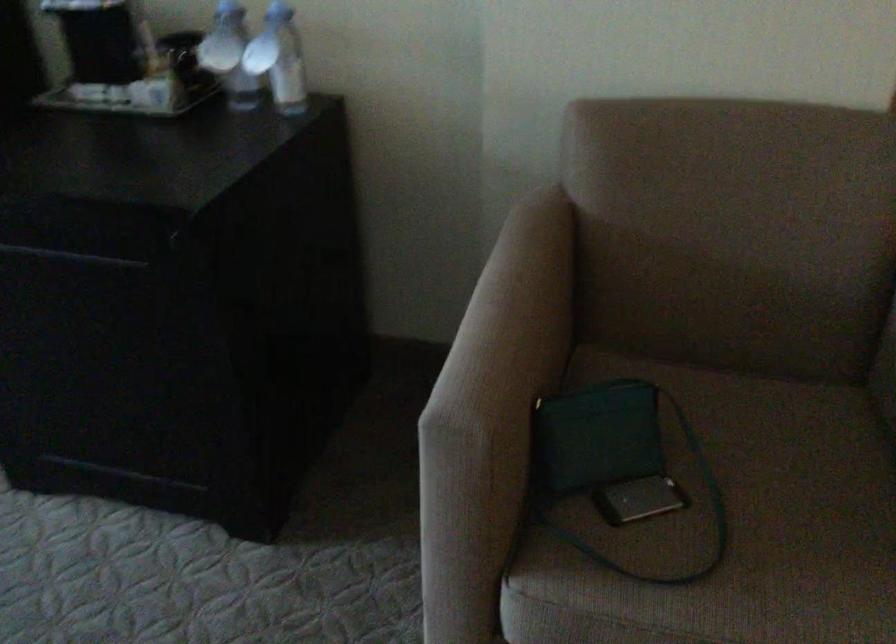
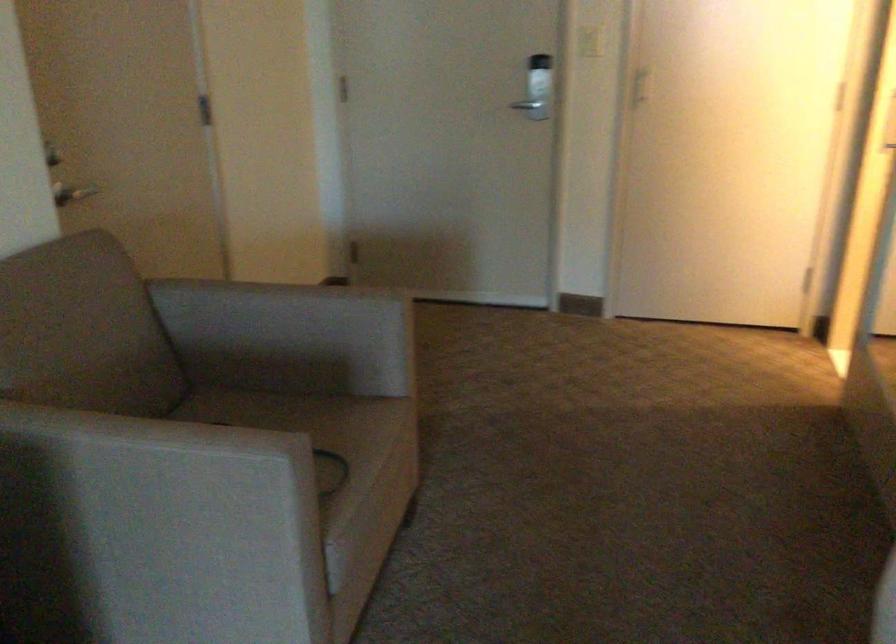
Locate, in the second image, the point that corresponds to point 495,390 in the first image.

(266, 431)